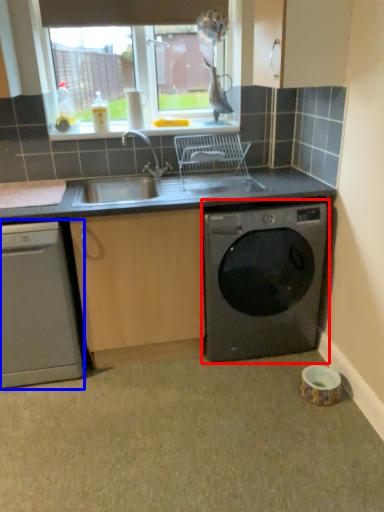
Question: Which point is further to the camera, washing machine (highlighted by a red box) or dishwasher (highlighted by a blue box)?

Choices:
 (A) washing machine
 (B) dishwasher

Answer: (A)